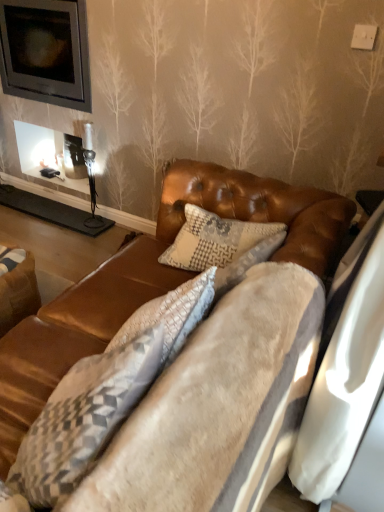
Question: Considering the relative sizes of velvet brown couch at center and textured gray pillow at center in the image provided, is velvet brown couch at center smaller than textured gray pillow at center?

Choices:
 (A) no
 (B) yes

Answer: (B)

Question: Can we say velvet brown couch at center lies outside textured gray pillow at center?

Choices:
 (A) yes
 (B) no

Answer: (A)

Question: Considering the relative sizes of velvet brown couch at center and textured gray pillow at center in the image provided, is velvet brown couch at center shorter than textured gray pillow at center?

Choices:
 (A) yes
 (B) no

Answer: (A)

Question: From the image's perspective, is velvet brown couch at center beneath textured gray pillow at center?

Choices:
 (A) yes
 (B) no

Answer: (B)

Question: Can you confirm if velvet brown couch at center is positioned to the right of textured gray pillow at center?

Choices:
 (A) no
 (B) yes

Answer: (B)

Question: From a real-world perspective, is velvet brown couch at center positioned above or below textured gray pillow at center?

Choices:
 (A) above
 (B) below

Answer: (A)

Question: Considering the positions of velvet brown couch at center and textured gray pillow at center in the image, is velvet brown couch at center taller or shorter than textured gray pillow at center?

Choices:
 (A) tall
 (B) short

Answer: (B)

Question: Is velvet brown couch at center wider or thinner than textured gray pillow at center?

Choices:
 (A) thin
 (B) wide

Answer: (A)

Question: Based on their sizes in the image, would you say velvet brown couch at center is bigger or smaller than textured gray pillow at center?

Choices:
 (A) small
 (B) big

Answer: (A)

Question: In terms of height, does velvet brown couch at center look taller or shorter compared to brown leather swivel chair at lower left?

Choices:
 (A) tall
 (B) short

Answer: (B)

Question: Considering the relative positions of velvet brown couch at center and brown leather swivel chair at lower left in the image provided, is velvet brown couch at center to the left or to the right of brown leather swivel chair at lower left?

Choices:
 (A) left
 (B) right

Answer: (B)

Question: Is velvet brown couch at center bigger or smaller than brown leather swivel chair at lower left?

Choices:
 (A) small
 (B) big

Answer: (A)

Question: Considering their positions, is velvet brown couch at center located in front of or behind brown leather swivel chair at lower left?

Choices:
 (A) behind
 (B) front

Answer: (B)

Question: Relative to velvet brown couch at center, is textured gray pillow at center in front or behind?

Choices:
 (A) behind
 (B) front

Answer: (A)

Question: Is textured gray pillow at center to the left or to the right of velvet brown couch at center in the image?

Choices:
 (A) left
 (B) right

Answer: (A)